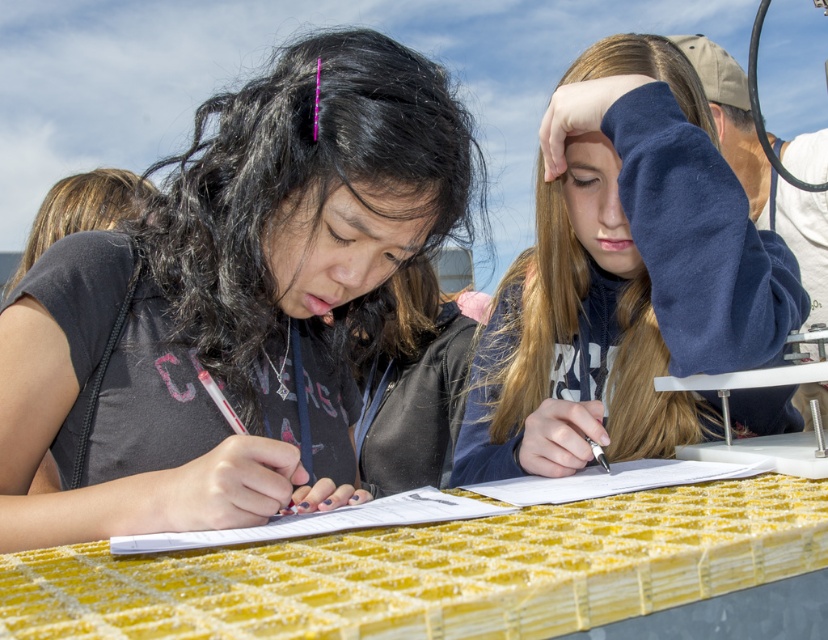
Which of these two, yellow textured table at center or white paper at center, stands taller?

With more height is yellow textured table at center.

Consider the image. Which is more to the left, yellow textured table at center or white paper at center?

From the viewer's perspective, white paper at center appears more on the left side.

Find the location of `yellow textured table at center`. yellow textured table at center is located at coordinates (436, 570).

Which is more to the right, matte black shirt at center or navy fleece hoodie at upper right?

From the viewer's perspective, navy fleece hoodie at upper right appears more on the right side.

Does matte black shirt at center have a larger size compared to navy fleece hoodie at upper right?

Correct, matte black shirt at center is larger in size than navy fleece hoodie at upper right.

Find the location of a particular element. The height and width of the screenshot is (640, 828). matte black shirt at center is located at coordinates (230, 301).

Is point (219, 257) farther from camera compared to point (610, 534)?

Yes, it is.

Does matte black shirt at center appear on the right side of yellow textured table at center?

Incorrect, matte black shirt at center is not on the right side of yellow textured table at center.

Is point (104, 432) positioned behind point (66, 628)?

Yes, it is behind point (66, 628).

You are a GUI agent. You are given a task and a screenshot of the screen. Output one action in this format:
    pyautogui.click(x=<x>, y=<y>)
    Task: Click on the matte black shirt at center
    
    Given the screenshot: What is the action you would take?
    pyautogui.click(x=230, y=301)